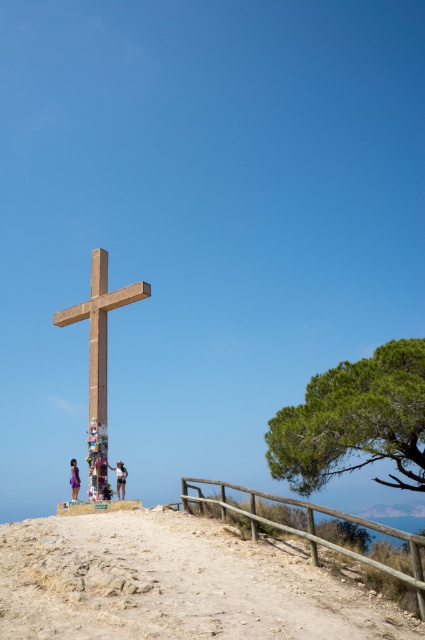
Which is more to the right, dirt path at center or wooden cross at center?

From the viewer's perspective, dirt path at center appears more on the right side.

Is dirt path at center taller than wooden cross at center?

No, dirt path at center is not taller than wooden cross at center.

At what (x,y) coordinates should I click in order to perform the action: click on dirt path at center. Please return your answer as a coordinate pair (x, y). Looking at the image, I should click on [175, 582].

Between light blue denim shorts at center and light brown wooden cross at center, which one has more height?

light brown wooden cross at center is taller.

Locate an element on the screen. light blue denim shorts at center is located at coordinates (119, 477).

Between dirt path at center and light brown wooden cross at center, which one appears on the right side from the viewer's perspective?

From the viewer's perspective, dirt path at center appears more on the right side.

Is dirt path at center positioned before light brown wooden cross at center?

Yes.

The width and height of the screenshot is (425, 640). Describe the element at coordinates (175, 582) in the screenshot. I see `dirt path at center` at that location.

I want to click on dirt path at center, so click(x=175, y=582).